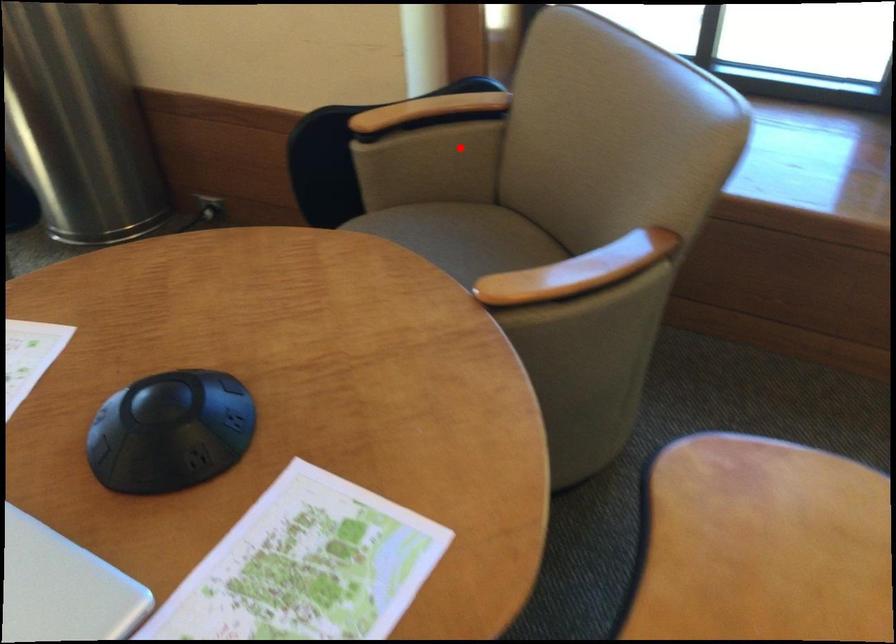
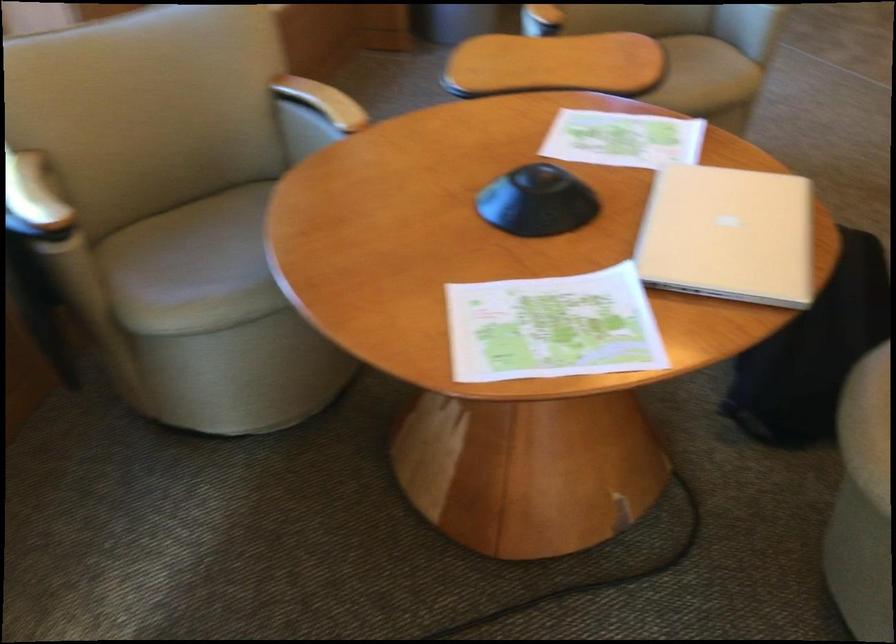
Question: I am providing you with two images of the same scene from different viewpoints. A red point is marked on the first image. At the location where the point appears in image 1, is it still visible in image 2?

Choices:
 (A) Yes
 (B) No

Answer: (A)